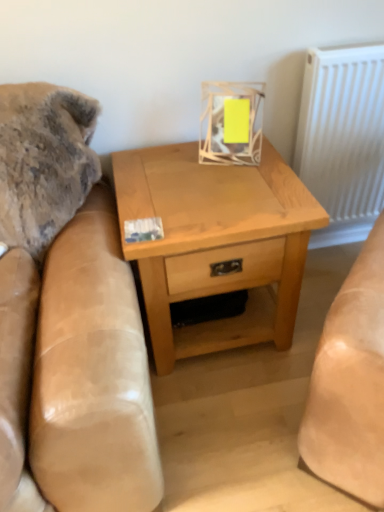
In order to face light wood/texture nightstand at center, should I rotate leftwards or rightwards?

You should rotate right by 2.104 degrees.

What do you see at coordinates (216, 243) in the screenshot?
I see `light wood/texture nightstand at center` at bounding box center [216, 243].

Identify the location of light wood/texture nightstand at center. (216, 243).

Measure the distance between light wood/texture nightstand at center and camera.

They are 1.06 meters apart.

Describe the element at coordinates (343, 138) in the screenshot. I see `white textured radiator at upper right` at that location.

Find the location of a particular element. Image resolution: width=384 pixels, height=512 pixels. white textured radiator at upper right is located at coordinates (343, 138).

Where is `light wood/texture nightstand at center`? The image size is (384, 512). light wood/texture nightstand at center is located at coordinates (216, 243).

Consider the image. Considering the positions of objects light wood/texture nightstand at center and white textured radiator at upper right in the image provided, who is more to the right, light wood/texture nightstand at center or white textured radiator at upper right?

white textured radiator at upper right is more to the right.

Which is in front, light wood/texture nightstand at center or white textured radiator at upper right?

light wood/texture nightstand at center is in front.

Is point (262, 324) less distant than point (335, 141)?

Yes, it is in front of point (335, 141).

From the image's perspective, is light wood/texture nightstand at center over white textured radiator at upper right?

Actually, light wood/texture nightstand at center appears below white textured radiator at upper right in the image.

Looking at this image, from a real-world perspective, does light wood/texture nightstand at center stand above white textured radiator at upper right?

Actually, light wood/texture nightstand at center is physically below white textured radiator at upper right in the real world.

Consider the image. Can you confirm if light wood/texture nightstand at center is thinner than white textured radiator at upper right?

No, light wood/texture nightstand at center is not thinner than white textured radiator at upper right.

Between light wood/texture nightstand at center and white textured radiator at upper right, which one has less height?

light wood/texture nightstand at center is shorter.

Who is smaller, light wood/texture nightstand at center or white textured radiator at upper right?

white textured radiator at upper right is smaller.

Would you say light wood/texture nightstand at center contains white textured radiator at upper right?

No, white textured radiator at upper right is not surrounded by light wood/texture nightstand at center.

Is light wood/texture nightstand at center far from white textured radiator at upper right?

Actually, light wood/texture nightstand at center and white textured radiator at upper right are a little close together.

Does light wood/texture nightstand at center turn towards white textured radiator at upper right?

No, light wood/texture nightstand at center does not turn towards white textured radiator at upper right.

Where is `radiator above the light wood/texture nightstand at center (from a real-world perspective)`? radiator above the light wood/texture nightstand at center (from a real-world perspective) is located at coordinates (343, 138).

Considering the relative positions of white textured radiator at upper right and light wood/texture nightstand at center in the image provided, is white textured radiator at upper right to the left of light wood/texture nightstand at center from the viewer's perspective?

Incorrect, white textured radiator at upper right is not on the left side of light wood/texture nightstand at center.

Considering the positions of objects white textured radiator at upper right and light wood/texture nightstand at center in the image provided, who is behind, white textured radiator at upper right or light wood/texture nightstand at center?

Positioned behind is white textured radiator at upper right.

Which point is more distant from viewer, (356, 182) or (200, 239)?

Point (356, 182)

From the image's perspective, between white textured radiator at upper right and light wood/texture nightstand at center, which one is located above?

white textured radiator at upper right is shown above in the image.

From a real-world perspective, who is located higher, white textured radiator at upper right or light wood/texture nightstand at center?

In real-world perspective, white textured radiator at upper right is above.

Based on the photo, is white textured radiator at upper right thinner than light wood/texture nightstand at center?

Correct, the width of white textured radiator at upper right is less than that of light wood/texture nightstand at center.

Can you confirm if white textured radiator at upper right is taller than light wood/texture nightstand at center?

Yes.

Does white textured radiator at upper right have a larger size compared to light wood/texture nightstand at center?

Incorrect, white textured radiator at upper right is not larger than light wood/texture nightstand at center.

Choose the correct answer: Is white textured radiator at upper right inside light wood/texture nightstand at center or outside it?

white textured radiator at upper right is outside light wood/texture nightstand at center.

Can you see white textured radiator at upper right touching light wood/texture nightstand at center?

white textured radiator at upper right is not next to light wood/texture nightstand at center, and they're not touching.

Is white textured radiator at upper right aimed at light wood/texture nightstand at center?

No, white textured radiator at upper right is not oriented towards light wood/texture nightstand at center.

Identify the location of nightstand below the white textured radiator at upper right (from a real-world perspective). The height and width of the screenshot is (512, 384). (216, 243).

Where is `nightstand that is on the left side of white textured radiator at upper right`? The image size is (384, 512). nightstand that is on the left side of white textured radiator at upper right is located at coordinates (216, 243).

Find the location of a particular element. Image resolution: width=384 pixels, height=512 pixels. radiator above the light wood/texture nightstand at center (from a real-world perspective) is located at coordinates (343, 138).